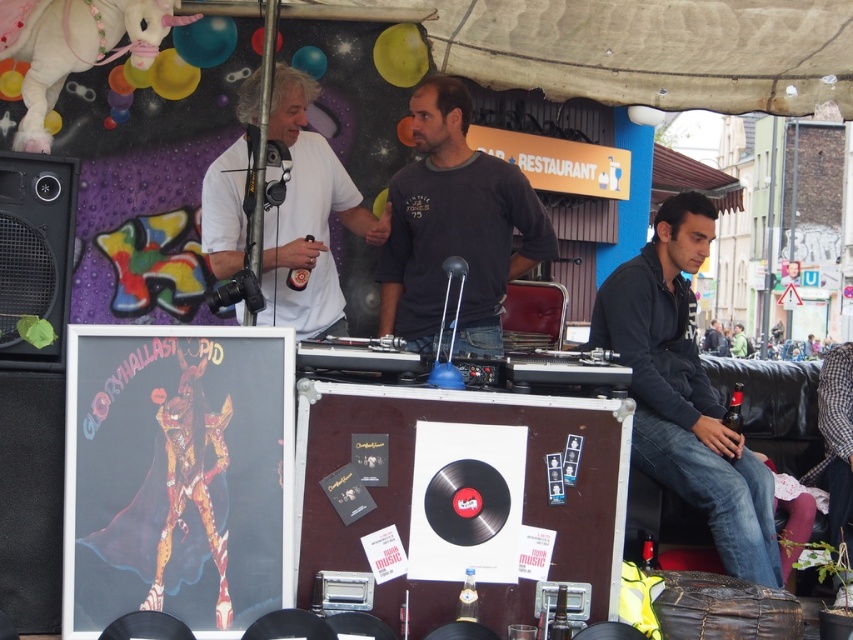
Does black softshell jacket at lower right appear on the left side of white matte t-shirt at upper left?

No, black softshell jacket at lower right is not to the left of white matte t-shirt at upper left.

The height and width of the screenshot is (640, 853). What do you see at coordinates (683, 392) in the screenshot?
I see `black softshell jacket at lower right` at bounding box center [683, 392].

Describe the element at coordinates (683, 392) in the screenshot. Image resolution: width=853 pixels, height=640 pixels. I see `black softshell jacket at lower right` at that location.

Find the location of a particular element. black softshell jacket at lower right is located at coordinates (683, 392).

Is black softshell jacket at lower right positioned behind dark gray long-sleeved shirt at center?

No.

Is black softshell jacket at lower right taller than dark gray long-sleeved shirt at center?

Correct, black softshell jacket at lower right is much taller as dark gray long-sleeved shirt at center.

Is point (751, 461) farther from camera compared to point (434, 336)?

No, (751, 461) is closer to viewer.

You are a GUI agent. You are given a task and a screenshot of the screen. Output one action in this format:
    pyautogui.click(x=<x>, y=<y>)
    Task: Click on the black softshell jacket at lower right
    
    Given the screenshot: What is the action you would take?
    pyautogui.click(x=683, y=392)

Looking at this image, does dark gray long-sleeved shirt at center have a lesser height compared to black matte speaker at left?

No, dark gray long-sleeved shirt at center is not shorter than black matte speaker at left.

Can you confirm if dark gray long-sleeved shirt at center is thinner than black matte speaker at left?

No.

Is point (503, 186) positioned before point (54, 358)?

No, it is not.

The width and height of the screenshot is (853, 640). Find the location of `dark gray long-sleeved shirt at center`. dark gray long-sleeved shirt at center is located at coordinates (456, 227).